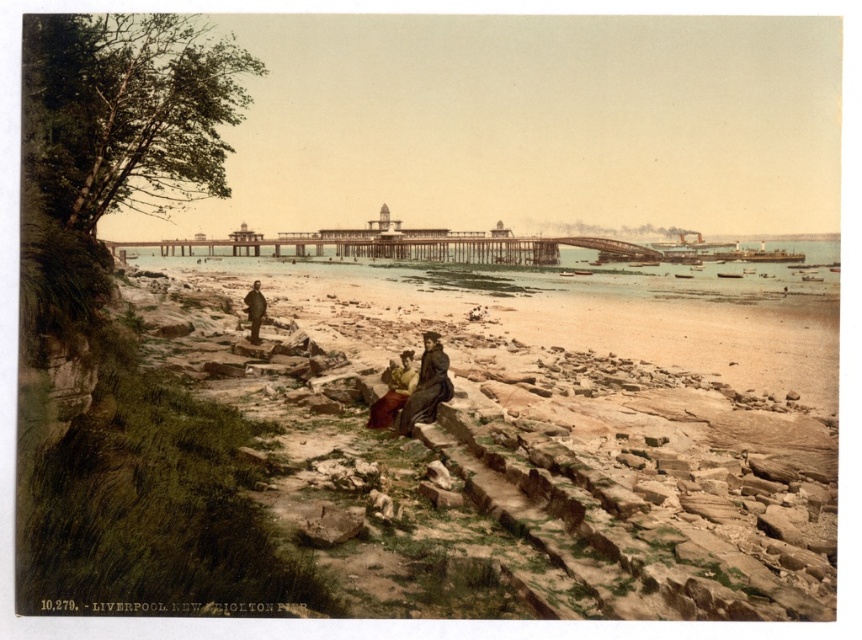
Question: Which point is closer to the camera?

Choices:
 (A) matte brown dress at center
 (B) matte yellow dress at center
 (C) clear water at center
 (D) dark brown leather coat at center

Answer: (A)

Question: Which point is closer to the camera?

Choices:
 (A) smooth sand beach at lower center
 (B) matte brown dress at center

Answer: (A)

Question: Is clear water at center wider than matte yellow dress at center?

Choices:
 (A) no
 (B) yes

Answer: (B)

Question: Is smooth sand beach at lower center positioned in front of matte yellow dress at center?

Choices:
 (A) no
 (B) yes

Answer: (B)

Question: Is smooth sand beach at lower center bigger than dark brown leather coat at center?

Choices:
 (A) no
 (B) yes

Answer: (B)

Question: Based on their relative distances, which object is nearer to the clear water at center?

Choices:
 (A) dark brown leather coat at center
 (B) matte brown dress at center
 (C) matte yellow dress at center
 (D) smooth sand beach at lower center

Answer: (D)